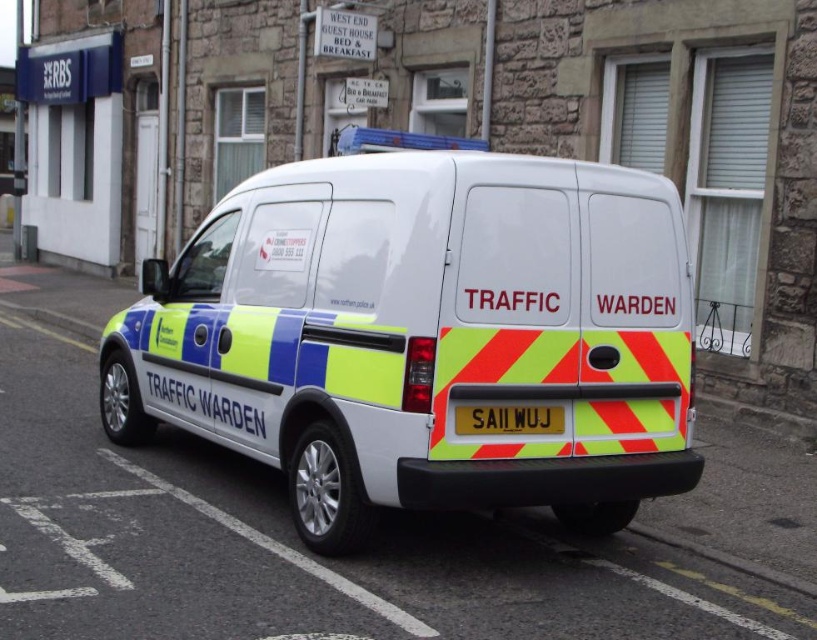
Is white glossy van at center taller than yellow reflective plate at rear?

Correct, white glossy van at center is much taller as yellow reflective plate at rear.

Which is below, white glossy van at center or yellow reflective plate at rear?

yellow reflective plate at rear is below.

Image resolution: width=817 pixels, height=640 pixels. In order to click on white glossy van at center in this screenshot , I will do [423, 337].

Identify the location of white glossy van at center. The image size is (817, 640). (423, 337).